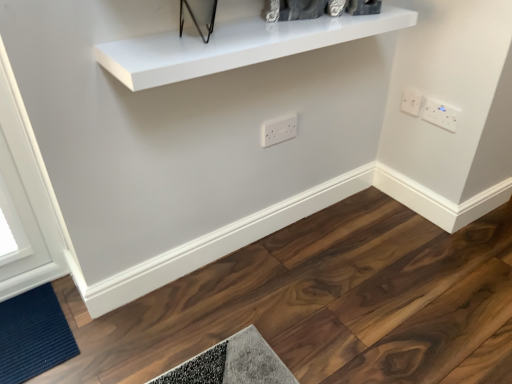
Question: From the image's perspective, is white plastic socket at upper right, placed as the 2th electric outlet when sorted from right to left, positioned above or below white glossy shelf at upper center?

Choices:
 (A) above
 (B) below

Answer: (B)

Question: Relative to white glossy shelf at upper center, is white plastic socket at upper right, acting as the 2th electric outlet starting from the left, in front or behind?

Choices:
 (A) front
 (B) behind

Answer: (B)

Question: Which is nearer to the white glossy shelf at upper center?

Choices:
 (A) dark blue textured mat at lower left
 (B) white plastic socket at upper right, acting as the 2th electric outlet starting from the left
 (C) white plastic outlet at center, which is the 3th electric outlet in right-to-left order
 (D) white plastic electric outlet at upper right, positioned as the 1th electric outlet in right-to-left order

Answer: (C)

Question: Which of these objects is positioned farthest from the white plastic socket at upper right, placed as the 2th electric outlet when sorted from right to left?

Choices:
 (A) dark blue textured mat at lower left
 (B) white glossy shelf at upper center
 (C) white plastic outlet at center, which is counted as the 1th electric outlet, starting from the left
 (D) white plastic electric outlet at upper right, which ranks as the 3th electric outlet in left-to-right order

Answer: (A)